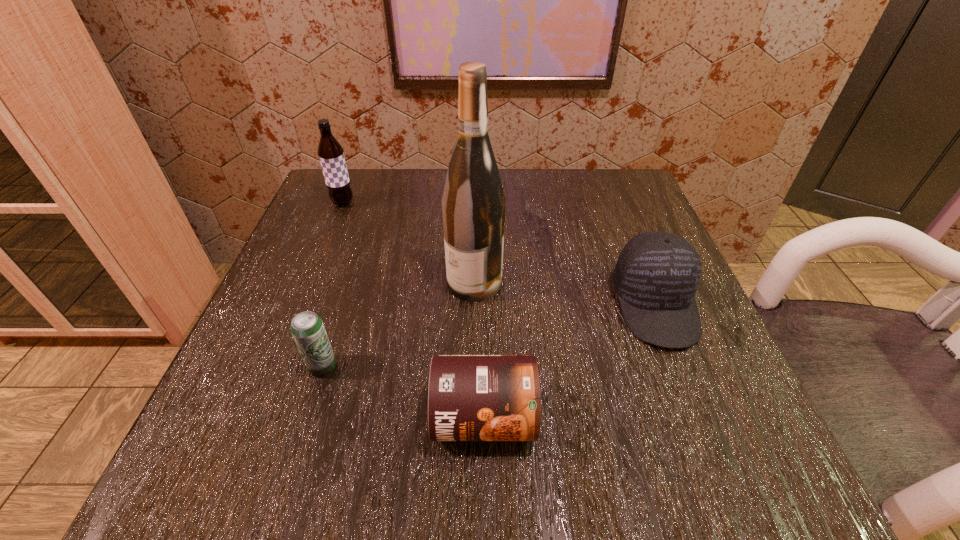
Image resolution: width=960 pixels, height=540 pixels. Find the location of `vacant area that lies between the root beer and the tallest object`. vacant area that lies between the root beer and the tallest object is located at coordinates (409, 242).

You are a GUI agent. You are given a task and a screenshot of the screen. Output one action in this format:
    pyautogui.click(x=<x>, y=<y>)
    Task: Click on the free space between the baseball cap and the nearest object
    Image resolution: width=960 pixels, height=540 pixels.
    Given the screenshot: What is the action you would take?
    pyautogui.click(x=569, y=361)

Locate which object ranks fourth in proximity to the wine bottle. Please provide its 2D coordinates. Your answer should be formatted as a tuple, i.e. [(x, y)], where the tuple contains the x and y coordinates of a point satisfying the conditions above.

[(331, 154)]

Where is `the second closest object relative to the rightmost object`? The height and width of the screenshot is (540, 960). the second closest object relative to the rightmost object is located at coordinates coord(473,203).